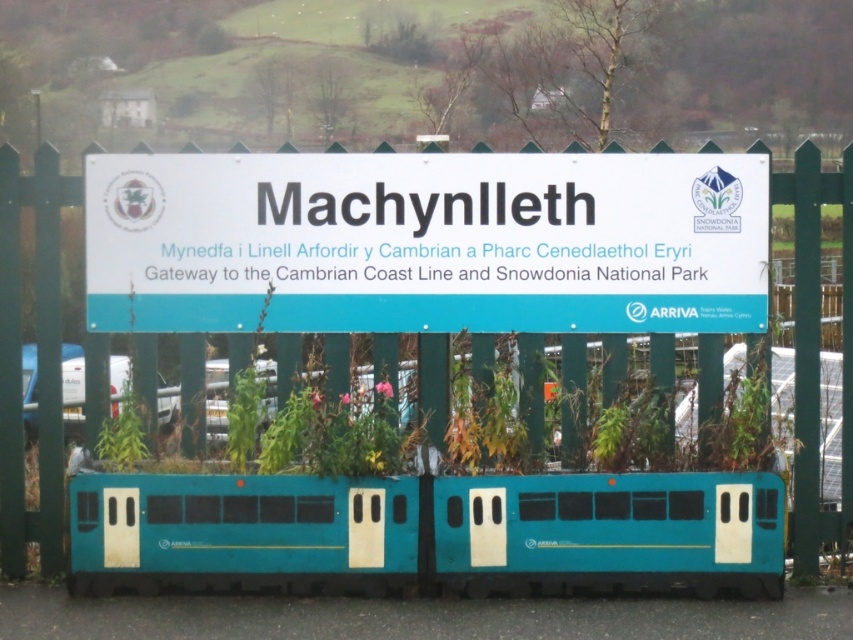
Can you confirm if teal matte train at center is taller than green wooden fence at center?

Incorrect, teal matte train at center's height is not larger of green wooden fence at center's.

Can you confirm if teal matte train at center is positioned below green wooden fence at center?

Yes, teal matte train at center is below green wooden fence at center.

Does point (587, 499) come farther from viewer compared to point (850, 200)?

That is False.

The width and height of the screenshot is (853, 640). I want to click on teal matte train at center, so click(x=428, y=532).

Which is in front, point (341, 193) or point (660, 141)?

Point (341, 193)

Consider the image. Is white plastic sign at center smaller than green wooden fence at center?

Correct, white plastic sign at center occupies less space than green wooden fence at center.

Find the location of `white plastic sign at center`. white plastic sign at center is located at coordinates (426, 243).

Can you confirm if white plastic sign at center is positioned to the left of teal matte train at center?

Indeed, white plastic sign at center is positioned on the left side of teal matte train at center.

Where is `white plastic sign at center`? The height and width of the screenshot is (640, 853). white plastic sign at center is located at coordinates (426, 243).